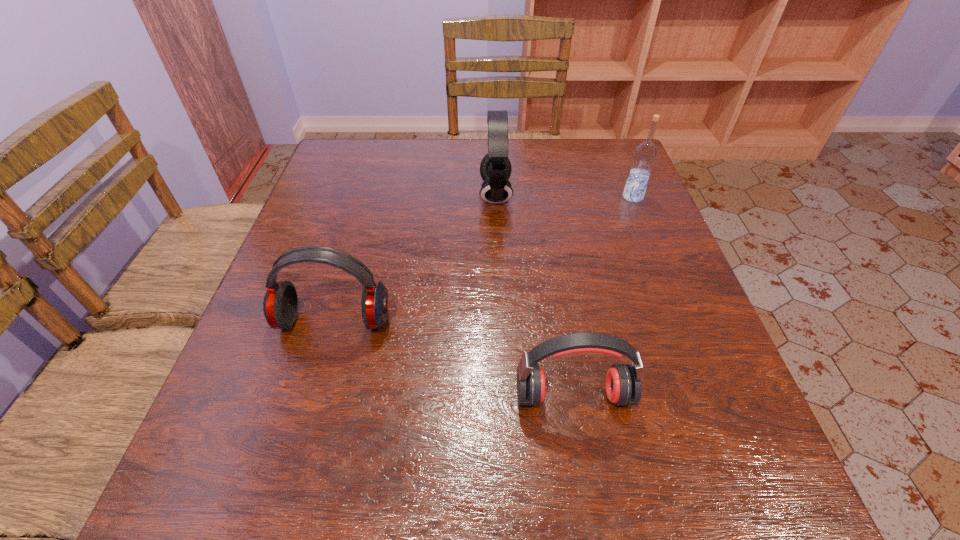
Find the location of `free space that satisfies the following two spatial constraints: 1. on the ear cups of the farthest earphone; 2. on the ear cups of the second farthest earphone`. free space that satisfies the following two spatial constraints: 1. on the ear cups of the farthest earphone; 2. on the ear cups of the second farthest earphone is located at coordinates (501, 321).

You are a GUI agent. You are given a task and a screenshot of the screen. Output one action in this format:
    pyautogui.click(x=<x>, y=<y>)
    Task: Click on the free space that satisfies the following two spatial constraints: 1. on the ear cups of the tallest earphone; 2. on the ear cups of the leftmost object
    The height and width of the screenshot is (540, 960).
    Given the screenshot: What is the action you would take?
    pyautogui.click(x=501, y=321)

Identify the location of free spot that satisfies the following two spatial constraints: 1. on the ear cups of the farthest earphone; 2. on the right side of the vodka. (495, 197).